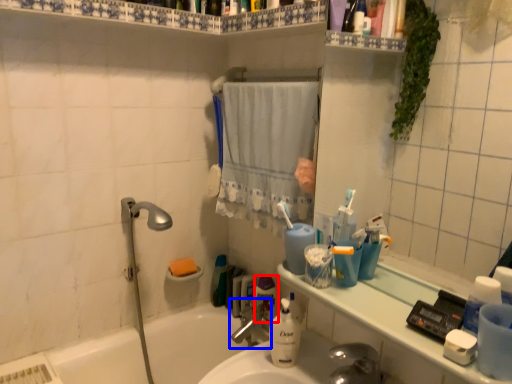
Question: Which object appears farthest to the camera in this image, mouthwash (highlighted by a red box) or tap (highlighted by a blue box)?

Choices:
 (A) mouthwash
 (B) tap

Answer: (A)